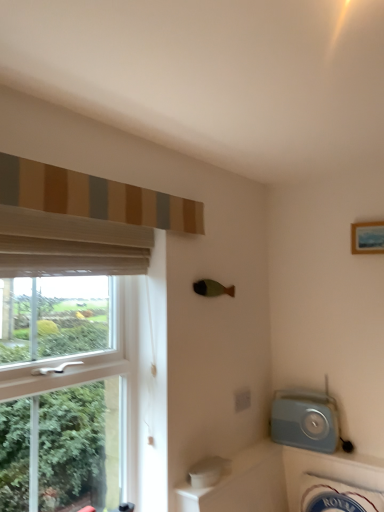
In order to click on matte blue radio at lower right in this screenshot , I will do pos(305,420).

I want to click on striped fabric curtain at upper left, the 2th curtain when ordered from bottom to top, so click(93, 197).

Image resolution: width=384 pixels, height=512 pixels. Describe the element at coordinates (330, 469) in the screenshot. I see `white ceramic bath at lower right` at that location.

Looking at this image, in order to face wooden framed picture at upper right, should I rotate leftwards or rightwards?

It's best to rotate right around 23.040 degrees.

Locate an element on the screen. Image resolution: width=384 pixels, height=512 pixels. matte blue radio at lower right is located at coordinates (305, 420).

From the image's perspective, which one is positioned higher, white ceramic bath at lower right or matte blue radio at lower right?

matte blue radio at lower right.

Does white ceramic bath at lower right have a lesser width compared to matte blue radio at lower right?

No, white ceramic bath at lower right is not thinner than matte blue radio at lower right.

Is white ceramic bath at lower right positioned far away from matte blue radio at lower right?

They are positioned close to each other.

Is white ceramic bath at lower right aimed at matte blue radio at lower right?

No, white ceramic bath at lower right is not facing towards matte blue radio at lower right.

Is wooden framed picture at upper right inside matte blue radio at lower right?

That's incorrect, wooden framed picture at upper right is not inside matte blue radio at lower right.

From a real-world perspective, is matte blue radio at lower right positioned above or below wooden framed picture at upper right?

Clearly, from a real-world perspective, matte blue radio at lower right is below wooden framed picture at upper right.

From the image's perspective, between matte blue radio at lower right and wooden framed picture at upper right, which one is located above?

From the image's view, wooden framed picture at upper right is above.

Locate an element on the screen. The width and height of the screenshot is (384, 512). appliance on the left of wooden framed picture at upper right is located at coordinates (305, 420).

Is striped fabric curtain at upper left, the 2th curtain when ordered from bottom to top, next to white ceramic bath at lower right and touching it?

They are not placed beside each other.

In terms of size, does striped fabric curtain at upper left, the 2th curtain when ordered from bottom to top, appear bigger or smaller than white ceramic bath at lower right?

striped fabric curtain at upper left, the 2th curtain when ordered from bottom to top, is smaller than white ceramic bath at lower right.

Can you tell me how much striped fabric curtain at upper left, the first curtain in the top-to-bottom sequence, and white ceramic bath at lower right differ in facing direction?

The angular difference between striped fabric curtain at upper left, the first curtain in the top-to-bottom sequence, and white ceramic bath at lower right is 87.5 degrees.

Is point (81, 205) behind point (362, 471)?

No, it is not.

How different are the orientations of striped fabric curtain at upper left, the 2th curtain when ordered from bottom to top, and wooden framed picture at upper right in degrees?

The angular difference between striped fabric curtain at upper left, the 2th curtain when ordered from bottom to top, and wooden framed picture at upper right is 90.4 degrees.

Which of these two, striped fabric curtain at upper left, the 2th curtain when ordered from bottom to top, or wooden framed picture at upper right, is bigger?

striped fabric curtain at upper left, the 2th curtain when ordered from bottom to top.

From a real-world perspective, is striped fabric curtain at upper left, the 2th curtain when ordered from bottom to top, under wooden framed picture at upper right?

No, from a real-world perspective, striped fabric curtain at upper left, the 2th curtain when ordered from bottom to top, is not below wooden framed picture at upper right.

Would you say striped fabric curtain at upper left, the first curtain in the top-to-bottom sequence, is outside wooden framed picture at upper right?

Yes, striped fabric curtain at upper left, the first curtain in the top-to-bottom sequence, is located beyond the bounds of wooden framed picture at upper right.

Based on their sizes in the image, would you say white ceramic bath at lower right is bigger or smaller than wooden framed picture at upper right?

Clearly, white ceramic bath at lower right is larger in size than wooden framed picture at upper right.

Is white ceramic bath at lower right positioned behind wooden framed picture at upper right?

No, white ceramic bath at lower right is closer to the viewer.

Is white ceramic bath at lower right not close to wooden framed picture at upper right?

That's right, there is a large distance between white ceramic bath at lower right and wooden framed picture at upper right.

Is wooden framed picture at upper right inside white ceramic bath at lower right?

No, wooden framed picture at upper right is located outside of white ceramic bath at lower right.

From a real-world perspective, which is physically above, wooden framed picture at upper right or white ceramic bath at lower right?

wooden framed picture at upper right, from a real-world perspective.

Based on the photo, does wooden framed picture at upper right lie behind white ceramic bath at lower right?

Yes, it is.

Considering the sizes of wooden framed picture at upper right and white ceramic bath at lower right in the image, is wooden framed picture at upper right bigger or smaller than white ceramic bath at lower right?

In the image, wooden framed picture at upper right appears to be smaller than white ceramic bath at lower right.

Consider the image. Between wooden framed picture at upper right and white ceramic bath at lower right, which one has less height?

With less height is wooden framed picture at upper right.

Is white ceramic bath at lower right aimed at white sheer curtain at left, which is the 2th curtain from top to bottom?

No, white ceramic bath at lower right is not facing towards white sheer curtain at left, which is the 2th curtain from top to bottom.

Which object is further away from the camera, white ceramic bath at lower right or white sheer curtain at left, which appears as the first curtain when ordered from the bottom?

white ceramic bath at lower right is further away from the camera.

Based on the photo, is white ceramic bath at lower right with white sheer curtain at left, which is the 2th curtain from top to bottom?

No, white ceramic bath at lower right is not touching white sheer curtain at left, which is the 2th curtain from top to bottom.

Based on the photo, from their relative heights in the image, would you say white ceramic bath at lower right is taller or shorter than white sheer curtain at left, which is the 2th curtain from top to bottom?

Clearly, white ceramic bath at lower right is taller compared to white sheer curtain at left, which is the 2th curtain from top to bottom.

At what (x,y) coordinates should I click in order to perform the action: click on bath that appears below the matte blue radio at lower right (from the image's perspective). Please return your answer as a coordinate pair (x, y). The image size is (384, 512). Looking at the image, I should click on (330, 469).

What are the coordinates of `picture frame that is above the matte blue radio at lower right (from the image's perspective)` in the screenshot? It's located at click(x=367, y=237).

Looking at the image, which one is located further to wooden framed picture at upper right, striped fabric curtain at upper left, the 2th curtain when ordered from bottom to top, or white sheer curtain at left, which appears as the first curtain when ordered from the bottom?

Among the two, white sheer curtain at left, which appears as the first curtain when ordered from the bottom, is located further to wooden framed picture at upper right.

Considering their positions, is wooden framed picture at upper right positioned closer to striped fabric curtain at upper left, the first curtain in the top-to-bottom sequence, than white ceramic bath at lower right?

Based on the image, wooden framed picture at upper right appears to be nearer to striped fabric curtain at upper left, the first curtain in the top-to-bottom sequence.

From the picture: Which object lies nearer to the anchor point white ceramic bath at lower right, wooden framed picture at upper right or white sheer curtain at left, which is the 2th curtain from top to bottom?

wooden framed picture at upper right is closer to white ceramic bath at lower right.

Estimate the real-world distances between objects in this image. Which object is further from white sheer curtain at left, which appears as the first curtain when ordered from the bottom, striped fabric curtain at upper left, the 2th curtain when ordered from bottom to top, or wooden framed picture at upper right?

wooden framed picture at upper right lies further to white sheer curtain at left, which appears as the first curtain when ordered from the bottom, than the other object.

Looking at the image, which one is located closer to striped fabric curtain at upper left, the 2th curtain when ordered from bottom to top, wooden framed picture at upper right or matte blue radio at lower right?

The object closer to striped fabric curtain at upper left, the 2th curtain when ordered from bottom to top, is wooden framed picture at upper right.

Estimate the real-world distances between objects in this image. Which object is further from white ceramic bath at lower right, matte blue radio at lower right or wooden framed picture at upper right?

wooden framed picture at upper right.

Looking at this image, which object lies nearer to the anchor point wooden framed picture at upper right, white sheer curtain at left, which is the 2th curtain from top to bottom, or white ceramic bath at lower right?

white ceramic bath at lower right is positioned closer to the anchor wooden framed picture at upper right.

From the image, which object appears to be farther from white ceramic bath at lower right, striped fabric curtain at upper left, the first curtain in the top-to-bottom sequence, or wooden framed picture at upper right?

striped fabric curtain at upper left, the first curtain in the top-to-bottom sequence, is positioned further to the anchor white ceramic bath at lower right.

Locate an element on the screen. This screenshot has width=384, height=512. appliance situated between white sheer curtain at left, which appears as the first curtain when ordered from the bottom, and wooden framed picture at upper right from left to right is located at coordinates (305, 420).

Where is `appliance between white sheer curtain at left, which appears as the first curtain when ordered from the bottom, and white ceramic bath at lower right from left to right`? appliance between white sheer curtain at left, which appears as the first curtain when ordered from the bottom, and white ceramic bath at lower right from left to right is located at coordinates (305, 420).

Find the location of a particular element. The image size is (384, 512). bath between white sheer curtain at left, which appears as the first curtain when ordered from the bottom, and wooden framed picture at upper right is located at coordinates (330, 469).

Image resolution: width=384 pixels, height=512 pixels. Find the location of `curtain that lies between striped fabric curtain at upper left, the 2th curtain when ordered from bottom to top, and white ceramic bath at lower right from top to bottom`. curtain that lies between striped fabric curtain at upper left, the 2th curtain when ordered from bottom to top, and white ceramic bath at lower right from top to bottom is located at coordinates (69, 245).